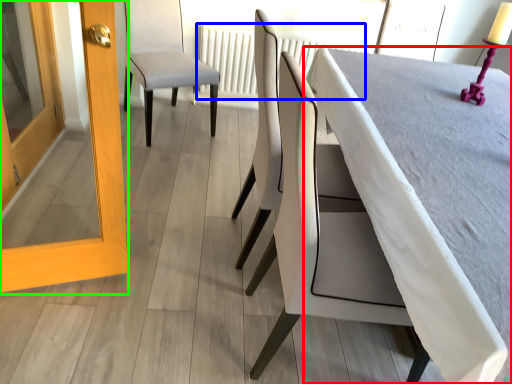
Question: Which is farther away from table (highlighted by a red box)? radiator (highlighted by a blue box) or screen door (highlighted by a green box)?

Choices:
 (A) radiator
 (B) screen door

Answer: (A)